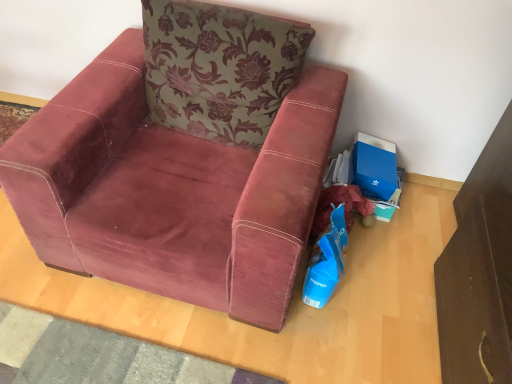
Question: From the image's perspective, is blue cardboard box at lower right under velvet maroon armchair at center?

Choices:
 (A) no
 (B) yes

Answer: (B)

Question: Considering the relative positions of blue cardboard box at lower right and velvet maroon armchair at center in the image provided, is blue cardboard box at lower right to the right of velvet maroon armchair at center from the viewer's perspective?

Choices:
 (A) no
 (B) yes

Answer: (B)

Question: Considering the relative sizes of blue cardboard box at lower right and velvet maroon armchair at center in the image provided, is blue cardboard box at lower right smaller than velvet maroon armchair at center?

Choices:
 (A) yes
 (B) no

Answer: (A)

Question: Is blue cardboard box at lower right closer to the viewer compared to velvet maroon armchair at center?

Choices:
 (A) no
 (B) yes

Answer: (A)

Question: Considering the relative sizes of blue cardboard box at lower right and velvet maroon armchair at center in the image provided, is blue cardboard box at lower right wider than velvet maroon armchair at center?

Choices:
 (A) no
 (B) yes

Answer: (A)

Question: Can you confirm if blue cardboard box at lower right is bigger than velvet maroon armchair at center?

Choices:
 (A) yes
 (B) no

Answer: (B)

Question: Is green floral fabric pillow at upper center wider than blue cardboard box at lower right?

Choices:
 (A) yes
 (B) no

Answer: (A)

Question: From the image's perspective, does green floral fabric pillow at upper center appear lower than blue cardboard box at lower right?

Choices:
 (A) yes
 (B) no

Answer: (B)

Question: Does green floral fabric pillow at upper center have a lesser width compared to blue cardboard box at lower right?

Choices:
 (A) yes
 (B) no

Answer: (B)

Question: Is green floral fabric pillow at upper center bigger than blue cardboard box at lower right?

Choices:
 (A) no
 (B) yes

Answer: (B)

Question: Is green floral fabric pillow at upper center placed right next to blue cardboard box at lower right?

Choices:
 (A) yes
 (B) no

Answer: (B)

Question: Can you confirm if green floral fabric pillow at upper center is shorter than blue cardboard box at lower right?

Choices:
 (A) no
 (B) yes

Answer: (A)

Question: Would you say blue plastic shopping bag at lower right is a long distance from velvet maroon armchair at center?

Choices:
 (A) yes
 (B) no

Answer: (B)